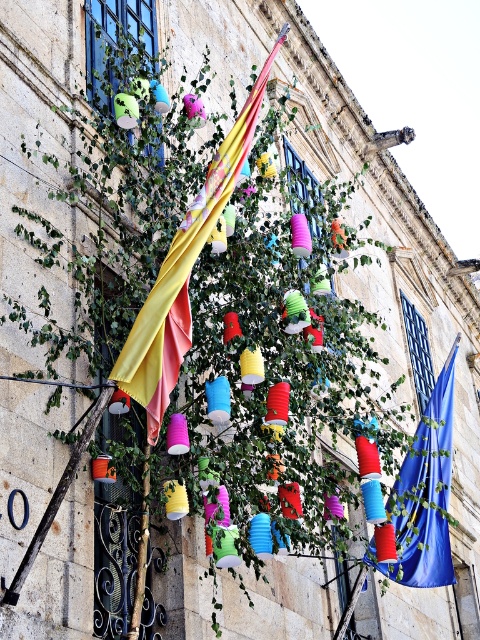
From the picture: Does yellow fabric flag at center appear on the right side of blue fabric flag at center?

No, yellow fabric flag at center is not to the right of blue fabric flag at center.

Is yellow fabric flag at center smaller than blue fabric flag at center?

Indeed, yellow fabric flag at center has a smaller size compared to blue fabric flag at center.

Does point (141, 323) come behind point (444, 476)?

No.

I want to click on yellow fabric flag at center, so click(183, 273).